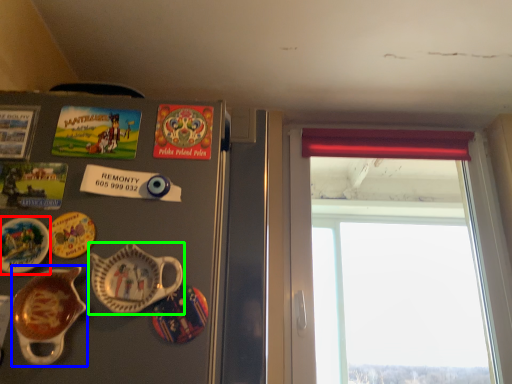
Question: Which is farther away from plate (highlighted by a red box)? tableware (highlighted by a blue box) or tableware (highlighted by a green box)?

Choices:
 (A) tableware
 (B) tableware

Answer: (B)